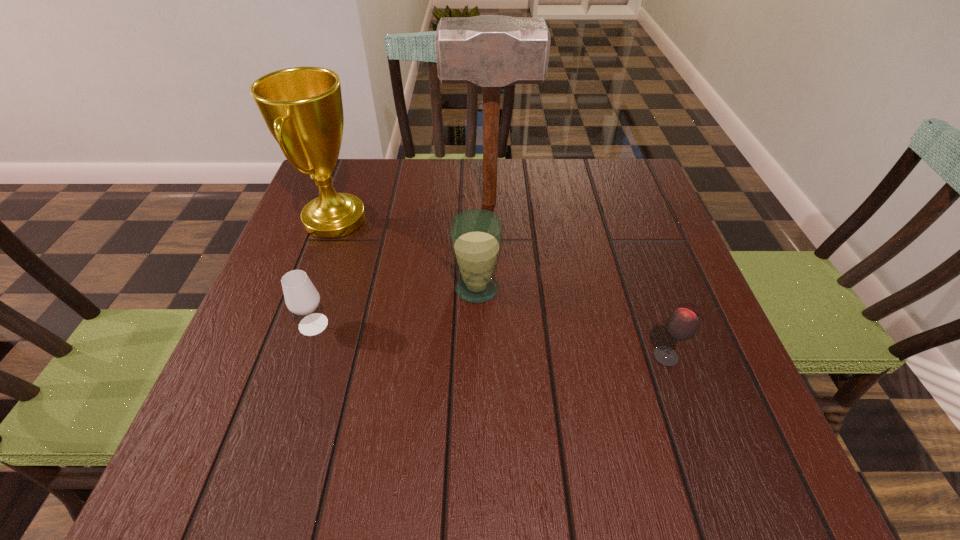
You are a GUI agent. You are given a task and a screenshot of the screen. Output one action in this format:
    pyautogui.click(x=<x>, y=<y>)
    Task: Click on the free space located on the striking face of the tallest object
    This screenshot has height=540, width=960.
    Given the screenshot: What is the action you would take?
    pyautogui.click(x=423, y=204)

Identify the location of free location located by the handles of the fourth shortest object. Image resolution: width=960 pixels, height=540 pixels. (497, 220).

Identify the location of vacant space located on the left of the tallest glass. The height and width of the screenshot is (540, 960). (278, 289).

Image resolution: width=960 pixels, height=540 pixels. Identify the location of vacant area located on the back of the rightmost glass. (616, 214).

What are the coordinates of `free region located 0.160m on the front of the fourth farthest object` in the screenshot? It's located at (283, 417).

Locate an element on the screen. This screenshot has height=540, width=960. mallet at the far edge is located at coordinates (491, 51).

You are a GUI agent. You are given a task and a screenshot of the screen. Output one action in this format:
    pyautogui.click(x=<x>, y=<y>)
    Task: Click on the award at the far edge
    
    Given the screenshot: What is the action you would take?
    pyautogui.click(x=302, y=107)

Where is `award located in the left edge section of the desktop`? award located in the left edge section of the desktop is located at coordinates (302, 107).

Where is `glass located at the left edge`? glass located at the left edge is located at coordinates (301, 297).

Find the location of a particular element. The height and width of the screenshot is (540, 960). object present at the right edge is located at coordinates (682, 324).